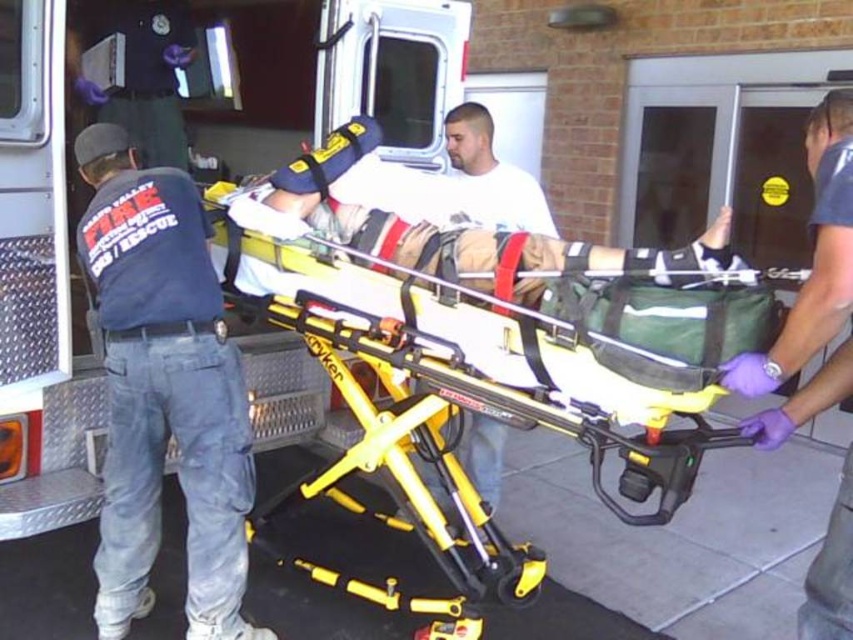
You are an emergency medical technician standing 6 feet away from the stretcher. You need to reach a medical kit located at point (844, 112). Can you comfortably reach it without moving closer?

The distance of point (844, 112) from viewer is 5.37 feet, so yes, you can comfortably reach it without moving closer since it is within your 6 feet range.

You are an emergency medical technician standing next to the dark blue uniform at left and need to quickly access the yellow metallic stretcher at center. Which direction should you move to reach it?

The yellow metallic stretcher at center is to the right of the dark blue uniform at left, so you should move to your right to reach it.